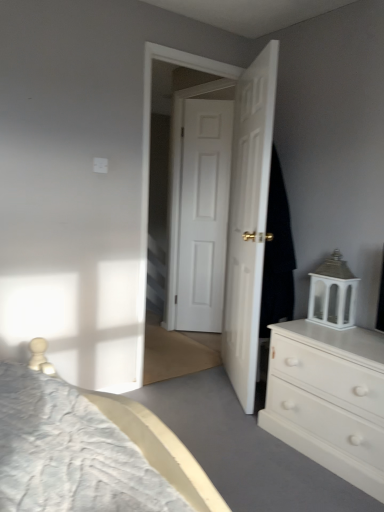
In order to click on vacant space to the left of white glossy door at center, placed as the 2th door when sorted from back to front in this screenshot , I will do `click(193, 392)`.